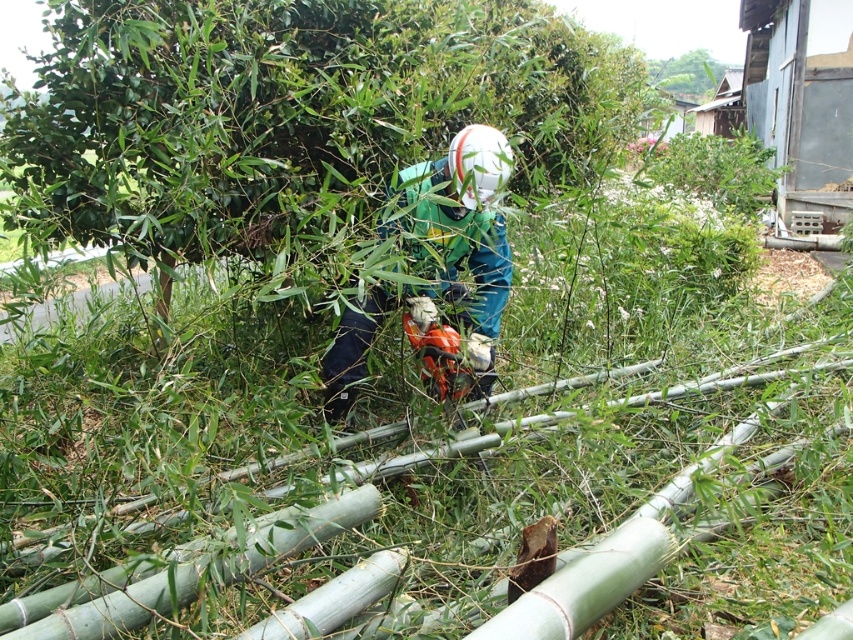
Does green bamboo at center have a larger size compared to green bamboo at upper center?

Correct, green bamboo at center is larger in size than green bamboo at upper center.

Who is positioned more to the left, green bamboo at center or green bamboo at upper center?

From the viewer's perspective, green bamboo at center appears more on the left side.

Does point (555, 147) come behind point (677, 88)?

No.

You are a GUI agent. You are given a task and a screenshot of the screen. Output one action in this format:
    pyautogui.click(x=<x>, y=<y>)
    Task: Click on the green bamboo at center
    Image resolution: width=853 pixels, height=640 pixels.
    Given the screenshot: What is the action you would take?
    pyautogui.click(x=289, y=115)

Is point (450, 152) closer to viewer compared to point (688, 58)?

Yes.

Is point (360, 371) closer to camera compared to point (672, 93)?

That is True.

Find the location of a particular element. green matte jacket at center is located at coordinates (457, 244).

Which is behind, point (596, 150) or point (489, 141)?

Positioned behind is point (596, 150).

Is green bamboo at center smaller than green matte jacket at center?

Incorrect, green bamboo at center is not smaller in size than green matte jacket at center.

Between point (152, 176) and point (473, 372), which one is positioned in front?

Point (473, 372) is more forward.

This screenshot has height=640, width=853. I want to click on green bamboo at center, so click(x=289, y=115).